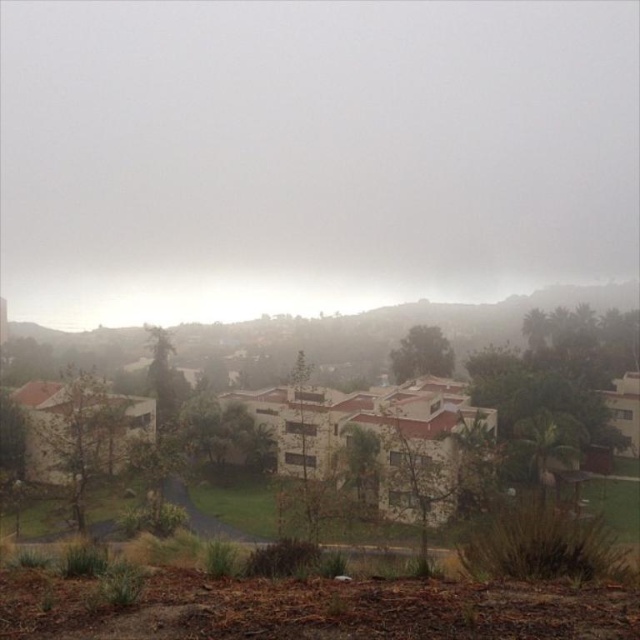
Question: Among these objects, which one is farthest from the camera?

Choices:
 (A) gray fog at upper center
 (B) white stucco buildings at center

Answer: (A)

Question: Does gray fog at upper center appear on the left side of white stucco buildings at center?

Choices:
 (A) yes
 (B) no

Answer: (A)

Question: Does gray fog at upper center appear on the right side of white stucco buildings at center?

Choices:
 (A) yes
 (B) no

Answer: (B)

Question: Is gray fog at upper center wider than white stucco buildings at center?

Choices:
 (A) no
 (B) yes

Answer: (B)